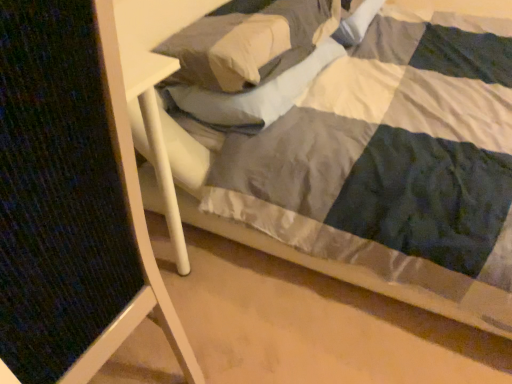
Where is `vacant area located to the right-hand side of textured fabric folding chair at left`? vacant area located to the right-hand side of textured fabric folding chair at left is located at coordinates (249, 311).